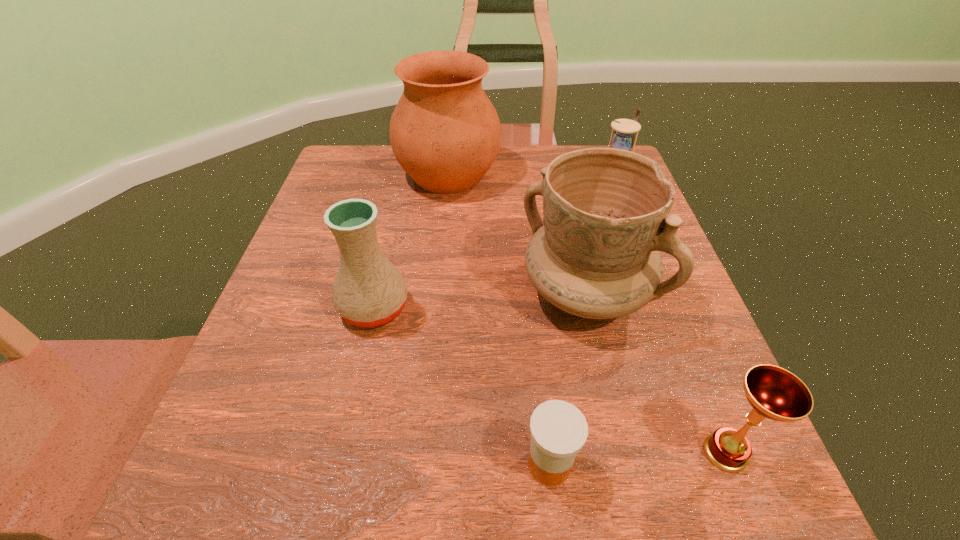
The image size is (960, 540). I want to click on vacant space situated on the back of the chalice, so click(x=667, y=307).

Identify the location of vacant space located on the label of the medicine. The width and height of the screenshot is (960, 540). click(410, 464).

Where is `vacant position located 0.360m on the label of the medicine`? vacant position located 0.360m on the label of the medicine is located at coordinates (267, 464).

The height and width of the screenshot is (540, 960). I want to click on vacant space located 0.110m on the label of the medicine, so click(x=445, y=464).

Where is `pottery located at the far edge`? pottery located at the far edge is located at coordinates (445, 133).

This screenshot has width=960, height=540. In order to click on hourglass that is at the far edge in this screenshot , I will do `click(623, 138)`.

Where is `chalice that is at the near edge`? chalice that is at the near edge is located at coordinates (775, 393).

Where is `medicine present at the near edge`? medicine present at the near edge is located at coordinates (558, 429).

This screenshot has height=540, width=960. I want to click on object that is at the left edge, so click(x=369, y=291).

The width and height of the screenshot is (960, 540). In order to click on pottery at the right edge in this screenshot , I will do `click(605, 210)`.